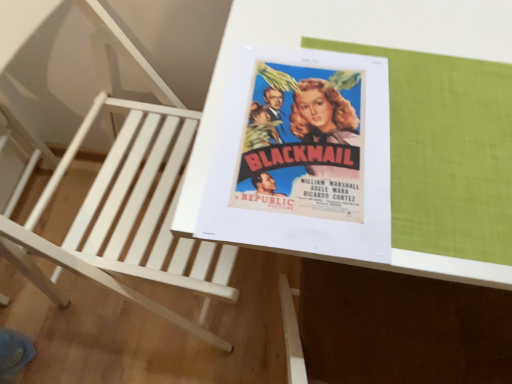
Identify the location of free space above white glossy table at center (from a real-world perspective). pos(387,99).